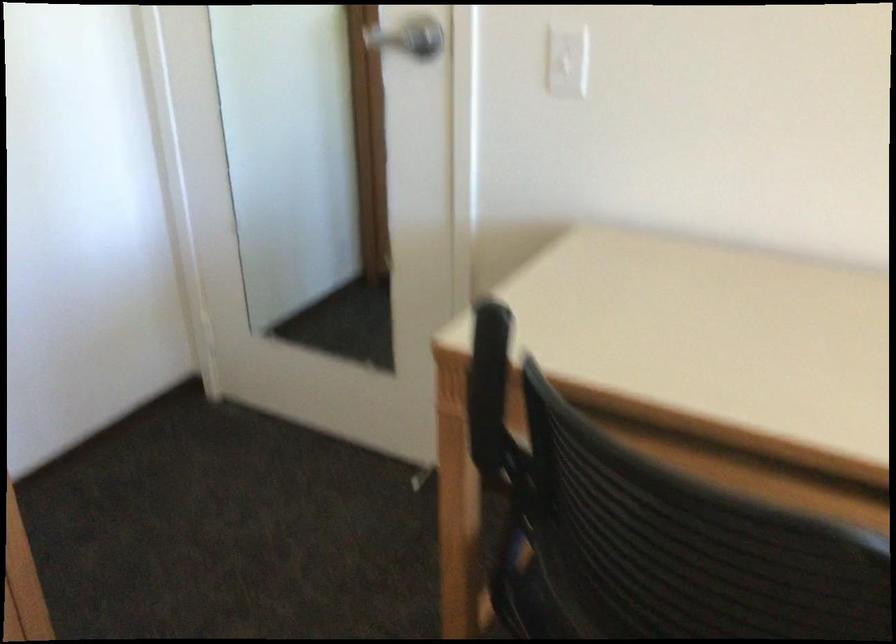
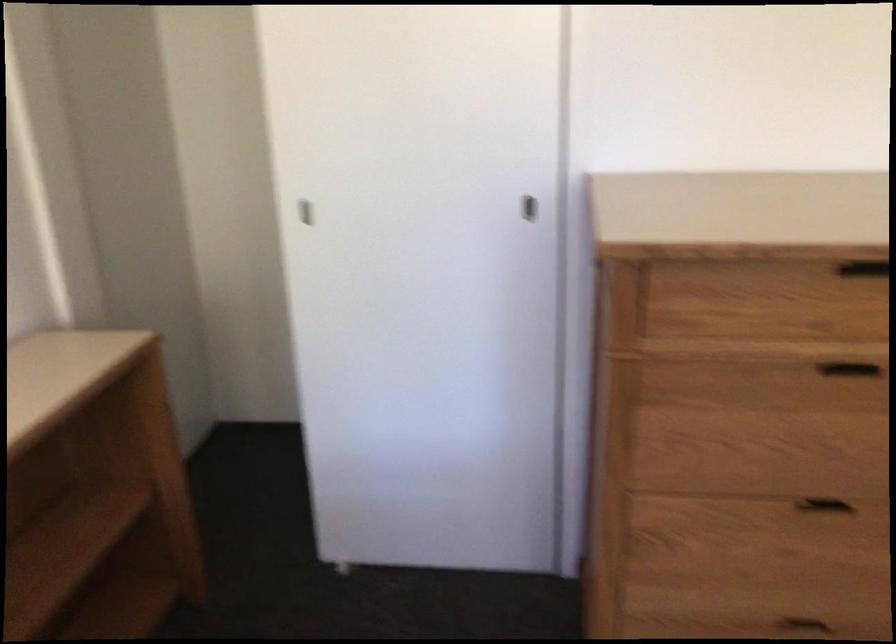
Question: Based on the continuous images, in which direction is the camera rotating? Reply with the corresponding letter.

Choices:
 (A) Left
 (B) Right
 (C) Up
 (D) Down

Answer: (A)